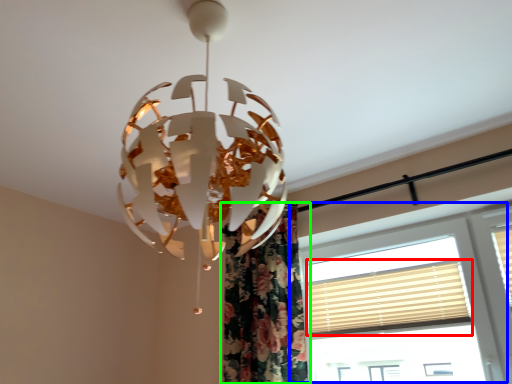
Question: Considering the real-world distances, which object is farthest from blind (highlighted by a red box)? window (highlighted by a blue box) or curtain (highlighted by a green box)?

Choices:
 (A) window
 (B) curtain

Answer: (B)